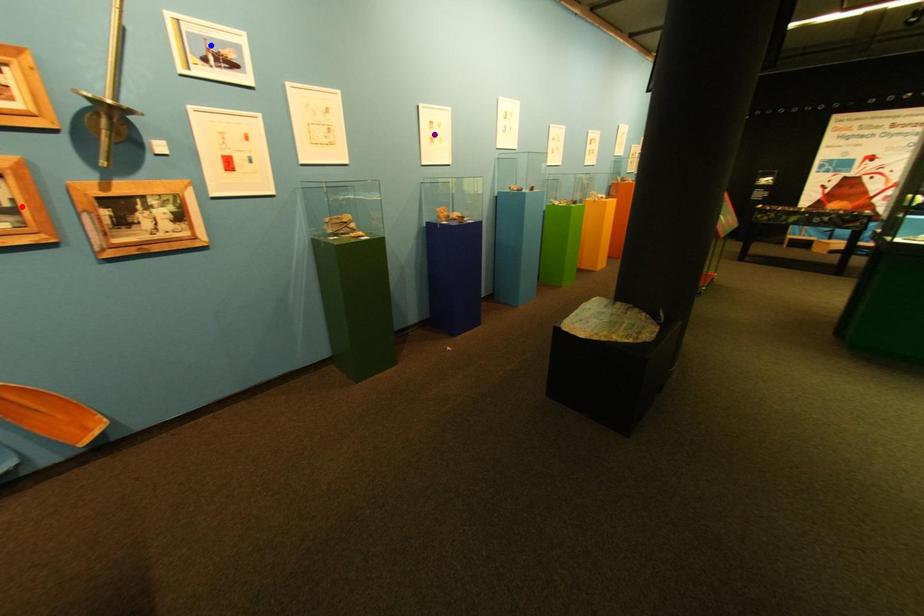
Order these from nearest to farthest:
purple point, red point, blue point

red point → blue point → purple point